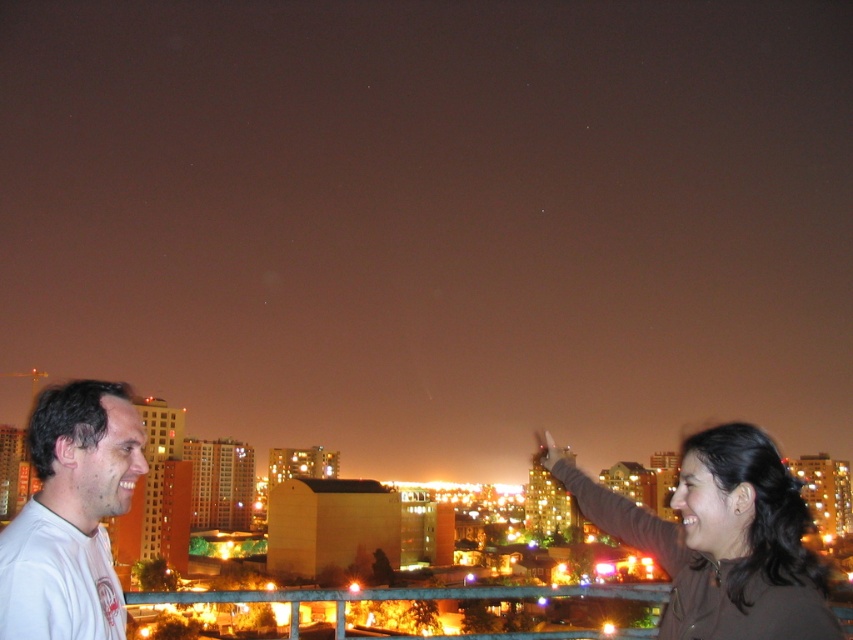
Question: From the image, what is the correct spatial relationship of brown matte jacket at upper right in relation to white cotton t-shirt at lower left?

Choices:
 (A) right
 (B) left

Answer: (A)

Question: Can you confirm if brown matte jacket at upper right is positioned above white cotton t-shirt at lower left?

Choices:
 (A) yes
 (B) no

Answer: (B)

Question: Which of the following is the farthest from the observer?

Choices:
 (A) white cotton t-shirt at lower left
 (B) brown matte jacket at upper right

Answer: (B)

Question: Which object appears closest to the camera in this image?

Choices:
 (A) white cotton t-shirt at lower left
 (B) brown matte jacket at upper right

Answer: (A)

Question: Can you confirm if brown matte jacket at upper right is positioned to the left of white cotton t-shirt at lower left?

Choices:
 (A) yes
 (B) no

Answer: (B)